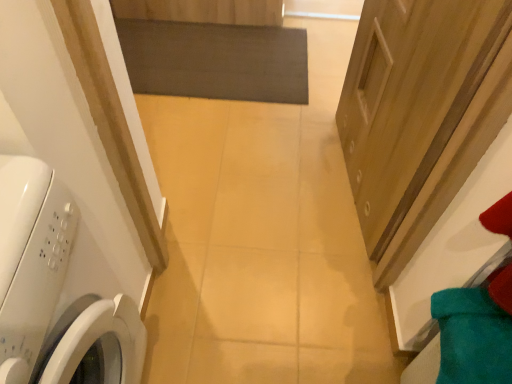
Question: Are white glossy washing machine at left and wooden door at right beside each other?

Choices:
 (A) no
 (B) yes

Answer: (A)

Question: Does white glossy washing machine at left appear on the left side of wooden door at right?

Choices:
 (A) yes
 (B) no

Answer: (A)

Question: Is white glossy washing machine at left located outside wooden door at right?

Choices:
 (A) no
 (B) yes

Answer: (B)

Question: Is white glossy washing machine at left positioned with its back to wooden door at right?

Choices:
 (A) no
 (B) yes

Answer: (A)

Question: Considering the relative sizes of white glossy washing machine at left and wooden door at right in the image provided, is white glossy washing machine at left taller than wooden door at right?

Choices:
 (A) no
 (B) yes

Answer: (B)

Question: From a real-world perspective, is white glossy washing machine at left located higher than wooden door at right?

Choices:
 (A) yes
 (B) no

Answer: (A)

Question: Does wooden door at right have a greater height compared to dark gray matte mat at center?

Choices:
 (A) no
 (B) yes

Answer: (B)

Question: Would you say wooden door at right is outside dark gray matte mat at center?

Choices:
 (A) yes
 (B) no

Answer: (A)

Question: Is wooden door at right to the left of dark gray matte mat at center from the viewer's perspective?

Choices:
 (A) no
 (B) yes

Answer: (A)

Question: Is wooden door at right smaller than dark gray matte mat at center?

Choices:
 (A) yes
 (B) no

Answer: (B)

Question: Is wooden door at right looking in the opposite direction of dark gray matte mat at center?

Choices:
 (A) no
 (B) yes

Answer: (A)

Question: Is wooden door at right at the right side of dark gray matte mat at center?

Choices:
 (A) no
 (B) yes

Answer: (B)

Question: Can you confirm if dark gray matte mat at center is smaller than wooden door at right?

Choices:
 (A) no
 (B) yes

Answer: (B)